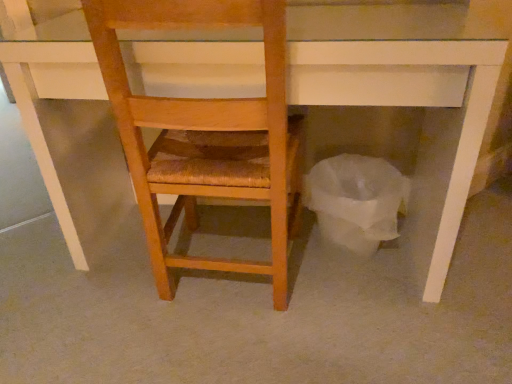
Locate an element on the screen. free spot in front of wooden chair at center is located at coordinates (233, 350).